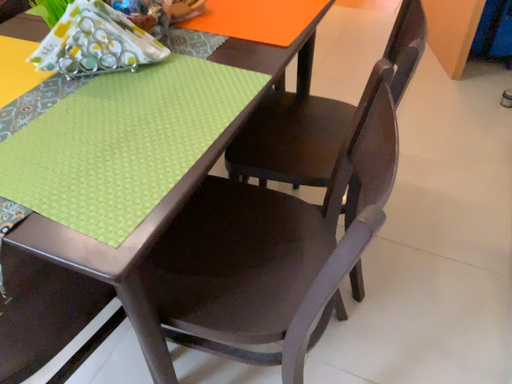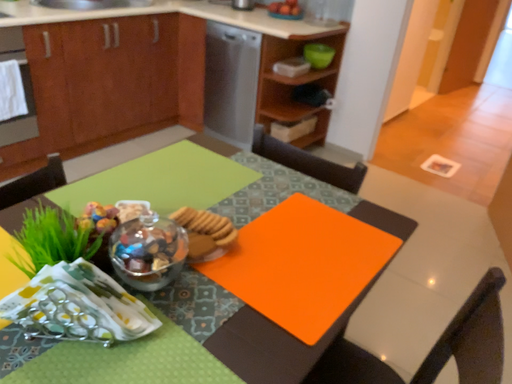
Question: Which way did the camera rotate in the video?

Choices:
 (A) rotated upward
 (B) rotated downward

Answer: (A)